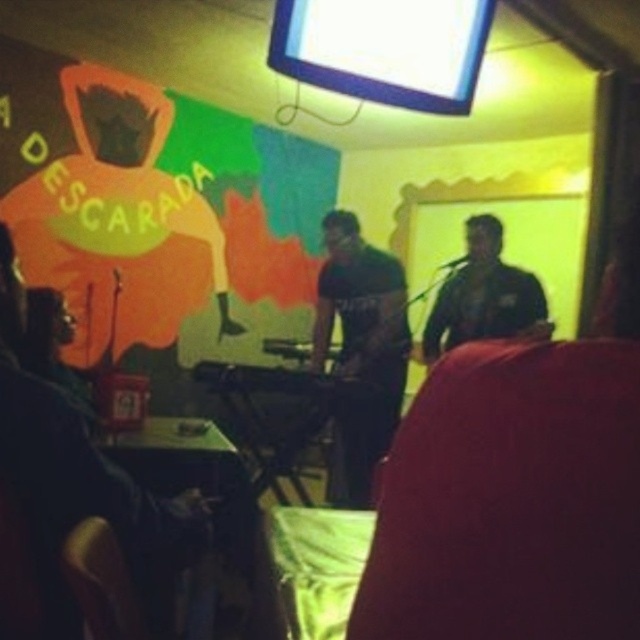
Which is more to the right, black matte keyboard at center or black matte guitar at center?

From the viewer's perspective, black matte guitar at center appears more on the right side.

Does black matte keyboard at center appear on the left side of black matte guitar at center?

Yes, black matte keyboard at center is to the left of black matte guitar at center.

This screenshot has width=640, height=640. I want to click on black matte keyboard at center, so click(x=360, y=349).

In order to click on black matte keyboard at center in this screenshot , I will do `click(360, 349)`.